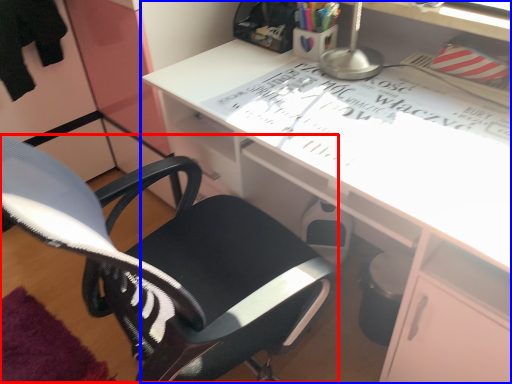
Question: Which object appears closest to the camera in this image, computer chair (highlighted by a red box) or desk (highlighted by a blue box)?

Choices:
 (A) computer chair
 (B) desk

Answer: (A)